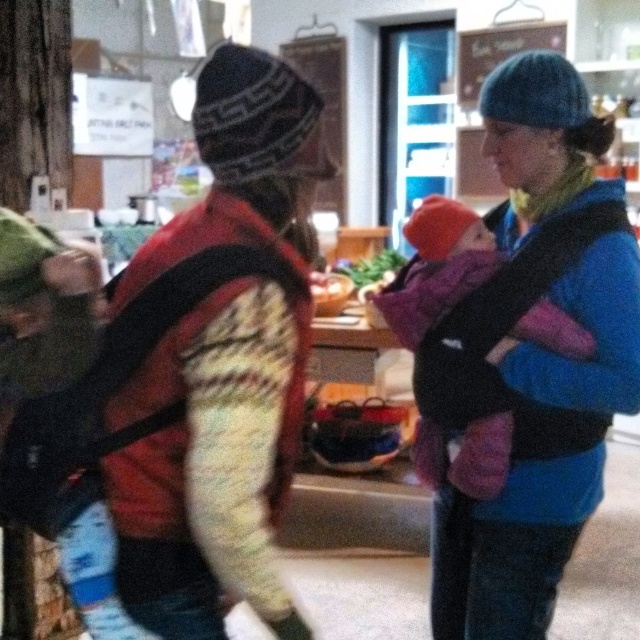
Question: Is blue knitted hat at upper right above purple fleece baby carrier at center?

Choices:
 (A) yes
 (B) no

Answer: (B)

Question: Is blue knitted hat at upper right in front of purple fleece baby carrier at center?

Choices:
 (A) yes
 (B) no

Answer: (A)

Question: Can you confirm if blue knitted hat at upper right is wider than purple fleece baby carrier at center?

Choices:
 (A) no
 (B) yes

Answer: (A)

Question: Which of the following is the closest to the observer?

Choices:
 (A) purple fleece baby carrier at center
 (B) blue knitted hat at upper right

Answer: (B)

Question: Which point appears closest to the camera in this image?

Choices:
 (A) (442, 561)
 (B) (458, 464)

Answer: (B)

Question: Among these points, which one is nearest to the camera?

Choices:
 (A) (618, 388)
 (B) (477, 476)

Answer: (A)